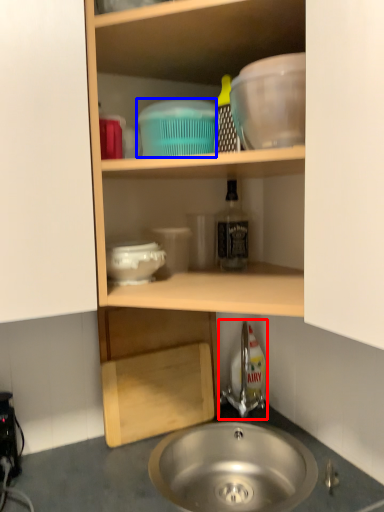
Question: Which object is closer to the camera taking this photo, tap (highlighted by a red box) or basin (highlighted by a blue box)?

Choices:
 (A) tap
 (B) basin

Answer: (B)